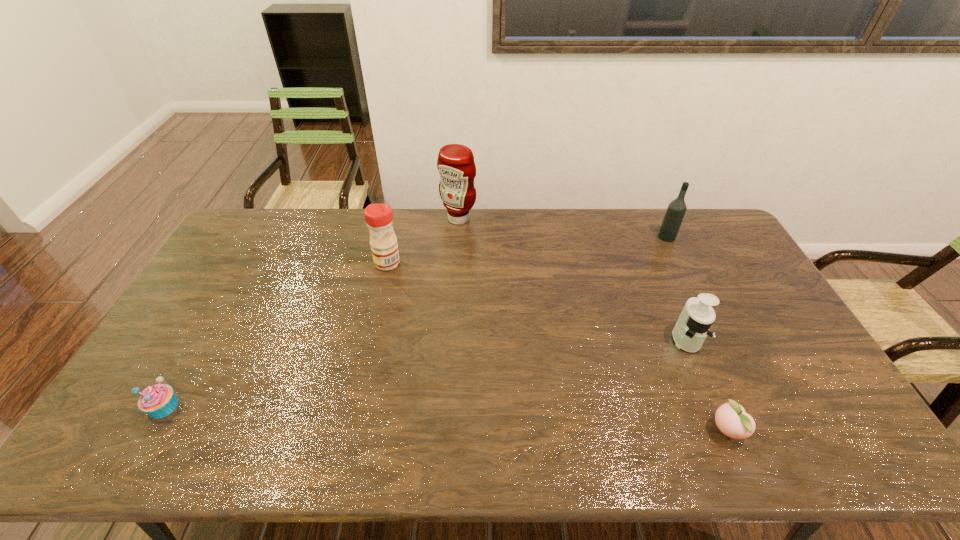
Where is `free space located 0.340m on the right of the farthest object`? This screenshot has height=540, width=960. free space located 0.340m on the right of the farthest object is located at coordinates (565, 219).

You are a GUI agent. You are given a task and a screenshot of the screen. Output one action in this format:
    pyautogui.click(x=<x>, y=<y>)
    Task: Click on the vacant space located 0.190m on the left of the left condiment
    The height and width of the screenshot is (540, 960).
    Given the screenshot: What is the action you would take?
    pyautogui.click(x=319, y=263)

You are a GUI agent. You are given a task and a screenshot of the screen. Output one action in this format:
    pyautogui.click(x=<x>, y=<y>)
    Task: Click on the free space located 0.230m on the front of the fifth nearest object
    The height and width of the screenshot is (540, 960).
    Given the screenshot: What is the action you would take?
    691,287

Identify the location of free region located on the left of the third nearest object. (603, 339).

Locate an element on the screen. vacant space located 0.330m on the back of the peach is located at coordinates (678, 315).

Identify the location of free space located 0.320m on the back of the leftmost object. The width and height of the screenshot is (960, 540). (223, 302).

This screenshot has height=540, width=960. Identify the location of condiment present at the far edge. (455, 164).

At what (x,y) coordinates should I click in order to perform the action: click on vodka present at the far edge. Please return your answer as a coordinate pair (x, y). The height and width of the screenshot is (540, 960). Looking at the image, I should click on (676, 210).

You are a GUI agent. You are given a task and a screenshot of the screen. Output one action in this format:
    pyautogui.click(x=<x>, y=<y>)
    Task: Click on the object at the near edge
    
    Given the screenshot: What is the action you would take?
    pyautogui.click(x=731, y=419)

The height and width of the screenshot is (540, 960). Find the location of `object located at the left edge`. object located at the left edge is located at coordinates (158, 401).